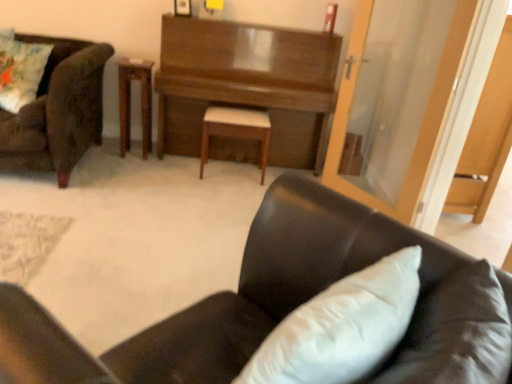
Identify the location of vacant region in front of shiny brown piano at center. (186, 207).